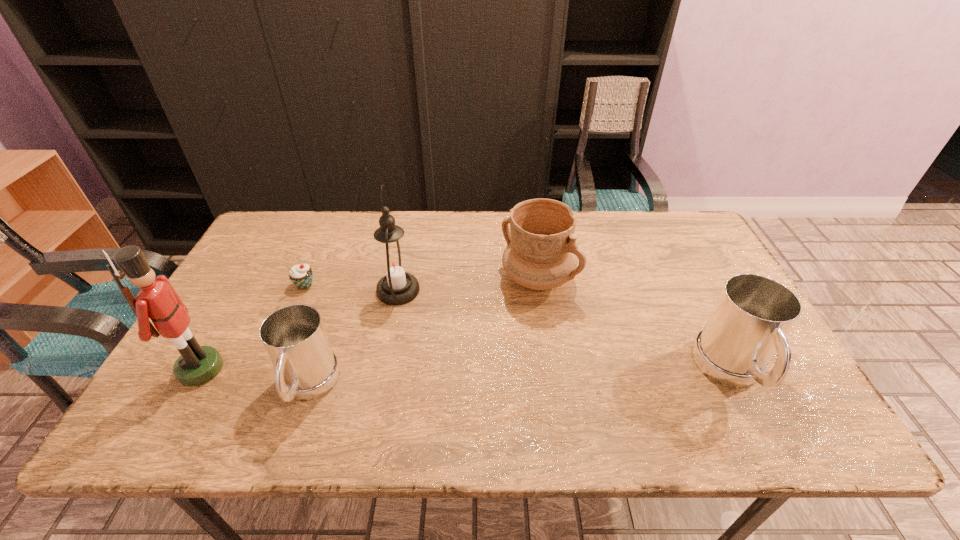
You are a GUI agent. You are given a task and a screenshot of the screen. Output one action in this format:
    pyautogui.click(x=<x>, y=<y>)
    Task: Click on the vacant area at the left edge
    The width and height of the screenshot is (960, 540).
    Given the screenshot: What is the action you would take?
    pyautogui.click(x=245, y=302)

Locate an element on the screen. The width and height of the screenshot is (960, 540). vacant space at the far left corner of the desktop is located at coordinates (297, 247).

Locate an element on the screen. Image resolution: width=960 pixels, height=540 pixels. vacant space at the near left corner of the desktop is located at coordinates (x=171, y=395).

This screenshot has width=960, height=540. I want to click on vacant region at the near right corner of the desktop, so click(x=779, y=393).

You are a GUI agent. You are given a task and a screenshot of the screen. Output one action in this format:
    pyautogui.click(x=<x>, y=<y>)
    Task: Click on the empty space that is in between the shortest object and the oil lamp
    
    Given the screenshot: What is the action you would take?
    pyautogui.click(x=351, y=288)

Where is `vacant space that is in between the nutcracker and the left mug`? This screenshot has width=960, height=540. vacant space that is in between the nutcracker and the left mug is located at coordinates (254, 379).

I want to click on vacant space that is in between the leftmost object and the taller mug, so click(467, 371).

The image size is (960, 540). I want to click on unoccupied position between the pottery and the fifth object from right to left, so click(x=421, y=282).

Where is `free spot between the second shortest object and the taller mug`? free spot between the second shortest object and the taller mug is located at coordinates (519, 380).

Where is `empty location between the fifth tallest object and the pottery`? The width and height of the screenshot is (960, 540). empty location between the fifth tallest object and the pottery is located at coordinates (423, 333).